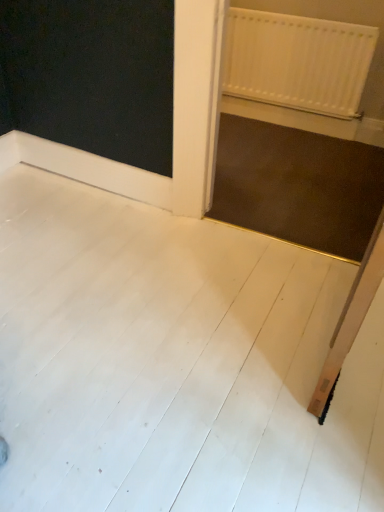
The height and width of the screenshot is (512, 384). Find the location of `blank space situated above white plastic radiator at upper right (from a real-world perspective)`. blank space situated above white plastic radiator at upper right (from a real-world perspective) is located at coordinates (329, 13).